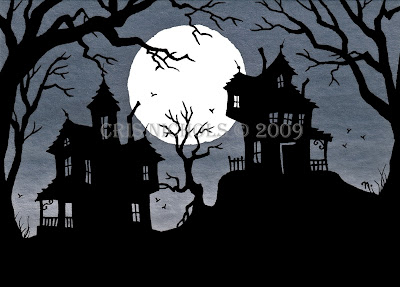
Where is `ajar house door`? ajar house door is located at coordinates (286, 161), (285, 183).